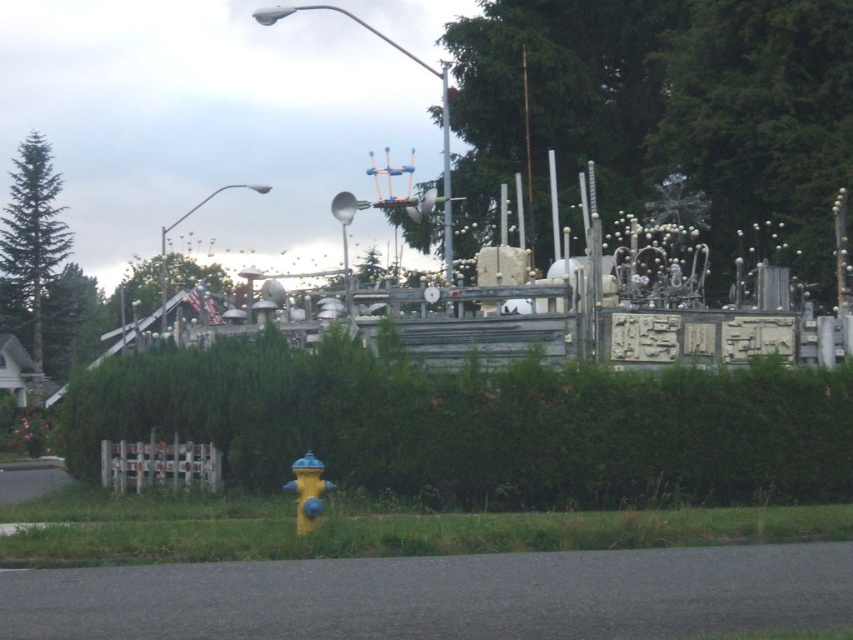
Question: Does green textured sculpture at center have a greater width compared to metallic pole at upper center?

Choices:
 (A) no
 (B) yes

Answer: (B)

Question: Does green textured sculpture at center have a larger size compared to green matte tree at upper center?

Choices:
 (A) yes
 (B) no

Answer: (B)

Question: Which point is farther to the camera?

Choices:
 (A) metallic pole at upper center
 (B) green matte tree at left
 (C) green matte tree at upper center
 (D) green matte tree at upper left

Answer: (D)

Question: Which object appears farthest from the camera in this image?

Choices:
 (A) green matte tree at upper left
 (B) green leafy hedge at center
 (C) green matte tree at left

Answer: (A)

Question: Does green textured sculpture at center appear on the right side of green matte tree at left?

Choices:
 (A) yes
 (B) no

Answer: (A)

Question: Which point is closer to the camera taking this photo?

Choices:
 (A) (129, 280)
 (B) (137, 371)

Answer: (B)